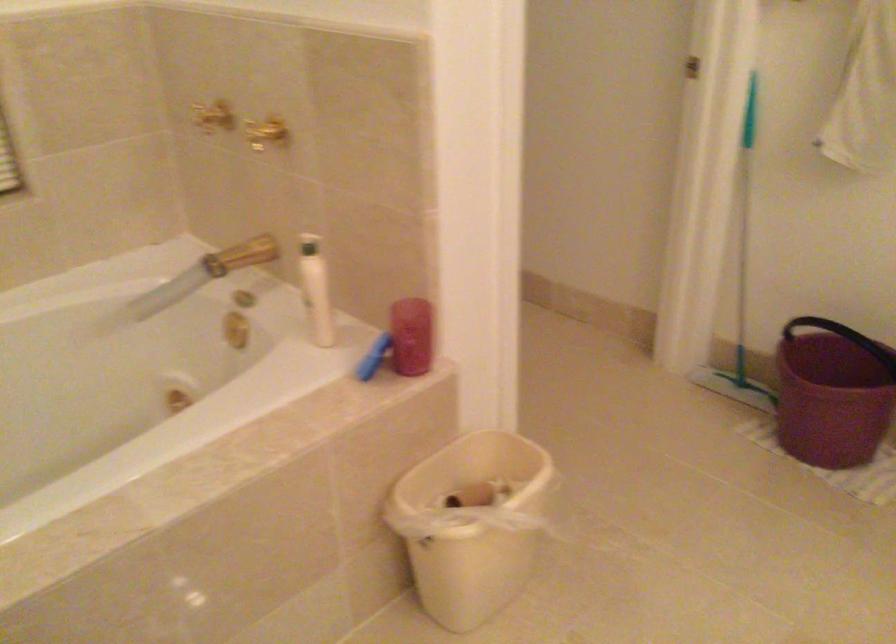
Where is `cream trash can`? cream trash can is located at coordinates (471, 524).